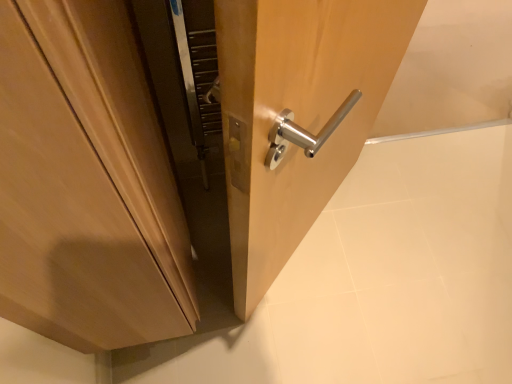
Locate an element on the screen. vacant region in front of polished silver handle at center is located at coordinates (307, 325).